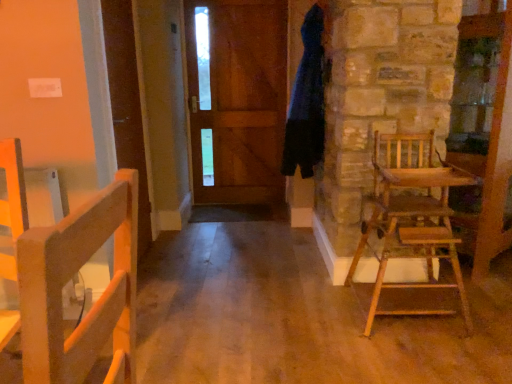
The image size is (512, 384). I want to click on wooden high chair at right, so click(x=412, y=217).

Image resolution: width=512 pixels, height=384 pixels. What do you see at coordinates (238, 99) in the screenshot?
I see `wooden door at center` at bounding box center [238, 99].

Locate an element on the screen. The width and height of the screenshot is (512, 384). wooden high chair at right is located at coordinates pyautogui.click(x=412, y=217).

Could you tell me if dark blue fabric bathrobe at upper right is facing wooden door at center?

No, dark blue fabric bathrobe at upper right is not oriented towards wooden door at center.

Locate an element on the screen. This screenshot has height=384, width=512. bathrobe lying below the wooden door at center (from the image's perspective) is located at coordinates (307, 101).

From the image's perspective, which one is positioned lower, dark blue fabric bathrobe at upper right or wooden door at center?

dark blue fabric bathrobe at upper right appears lower in the image.

Is dark blue fabric bathrobe at upper right directly adjacent to wooden door at center?

No, dark blue fabric bathrobe at upper right is not making contact with wooden door at center.

Is wooden high chair at right inside dark blue fabric bathrobe at upper right?

No, dark blue fabric bathrobe at upper right does not contain wooden high chair at right.

From the image's perspective, which one is positioned higher, dark blue fabric bathrobe at upper right or wooden high chair at right?

dark blue fabric bathrobe at upper right appears higher in the image.

What's the angular difference between dark blue fabric bathrobe at upper right and wooden high chair at right's facing directions?

There is a 84.7-degree angle between the facing directions of dark blue fabric bathrobe at upper right and wooden high chair at right.

In terms of height, does dark blue fabric bathrobe at upper right look taller or shorter compared to wooden high chair at right?

Clearly, dark blue fabric bathrobe at upper right is taller compared to wooden high chair at right.

Where is `bathrobe located above the wooden door at center (from a real-world perspective)`? The width and height of the screenshot is (512, 384). bathrobe located above the wooden door at center (from a real-world perspective) is located at coordinates (307, 101).

In the image, is wooden door at center on the left side or the right side of dark blue fabric bathrobe at upper right?

Clearly, wooden door at center is on the left of dark blue fabric bathrobe at upper right in the image.

From a real-world perspective, who is located lower, wooden door at center or dark blue fabric bathrobe at upper right?

wooden door at center.

Which of these two, wooden high chair at right or dark blue fabric bathrobe at upper right, stands shorter?

Standing shorter between the two is wooden high chair at right.

Between point (444, 197) and point (310, 158), which one is positioned in front?

Point (444, 197)

The image size is (512, 384). Find the location of `bathrobe above the wooden high chair at right (from a real-world perspective)`. bathrobe above the wooden high chair at right (from a real-world perspective) is located at coordinates tap(307, 101).

Which of these two, wooden high chair at right or dark blue fabric bathrobe at upper right, is bigger?

wooden high chair at right is bigger.

From the picture: Which object is thinner, wooden door at center or wooden high chair at right?

With smaller width is wooden door at center.

From a real-world perspective, is wooden door at center located higher than wooden high chair at right?

Yes, from a real-world perspective, wooden door at center is above wooden high chair at right.

How many degrees apart are the facing directions of wooden door at center and wooden high chair at right?

They differ by 2.43 degrees in their facing directions.

At what (x,y) coordinates should I click in order to perform the action: click on chair on the right of wooden door at center. Please return your answer as a coordinate pair (x, y). The width and height of the screenshot is (512, 384). Looking at the image, I should click on (412, 217).

Is wooden high chair at right beside wooden door at center?

No, wooden high chair at right is not with wooden door at center.

Is point (402, 142) closer to viewer compared to point (221, 50)?

Yes, it is.

From a real-world perspective, is wooden high chair at right physically above wooden door at center?

Actually, wooden high chair at right is physically below wooden door at center in the real world.

Considering the sizes of objects wooden high chair at right and wooden door at center in the image provided, who is wider, wooden high chair at right or wooden door at center?

wooden high chair at right is wider.

Identify the location of door that appears behind the dark blue fabric bathrobe at upper right. (238, 99).

Locate an element on the screen. This screenshot has width=512, height=384. bathrobe located on the left of wooden high chair at right is located at coordinates (307, 101).

Estimate the real-world distances between objects in this image. Which object is further from wooden high chair at right, dark blue fabric bathrobe at upper right or wooden door at center?

wooden door at center.

Estimate the real-world distances between objects in this image. Which object is further from wooden door at center, wooden high chair at right or dark blue fabric bathrobe at upper right?

wooden high chair at right is positioned further to the anchor wooden door at center.

From the image, which object appears to be nearer to dark blue fabric bathrobe at upper right, wooden door at center or wooden high chair at right?

wooden high chair at right lies closer to dark blue fabric bathrobe at upper right than the other object.

From the picture: Estimate the real-world distances between objects in this image. Which object is further from dark blue fabric bathrobe at upper right, wooden high chair at right or wooden door at center?

wooden door at center is positioned further to the anchor dark blue fabric bathrobe at upper right.

When comparing their distances from wooden door at center, does dark blue fabric bathrobe at upper right or wooden high chair at right seem further?

wooden high chair at right is further to wooden door at center.

Considering their positions, is wooden door at center positioned further to wooden high chair at right than dark blue fabric bathrobe at upper right?

Based on the image, wooden door at center appears to be further to wooden high chair at right.

Locate an element on the screen. The width and height of the screenshot is (512, 384). bathrobe located between wooden high chair at right and wooden door at center in the depth direction is located at coordinates (307, 101).